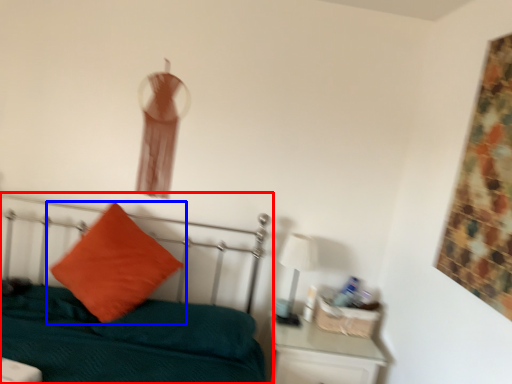
Question: Which object is further to the camera taking this photo, bed (highlighted by a red box) or pillow (highlighted by a blue box)?

Choices:
 (A) bed
 (B) pillow

Answer: (B)